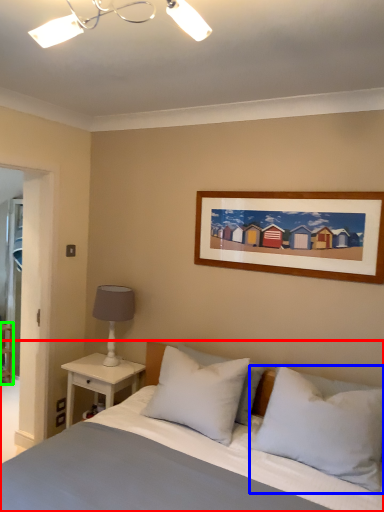
Question: Estimate the real-world distances between objects in this image. Which object is farther from bed (highlighted by a red box), pillow (highlighted by a blue box) or shelf (highlighted by a green box)?

Choices:
 (A) pillow
 (B) shelf

Answer: (B)